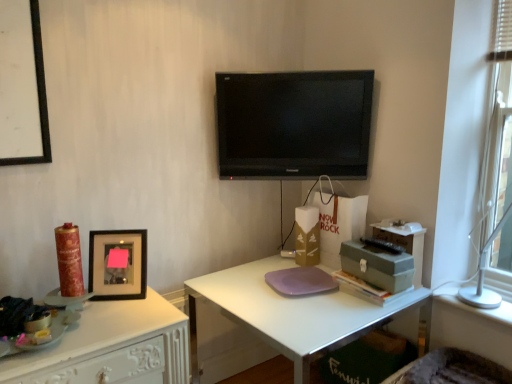
Where is `empty space that is ontop of matte green box at right, arranged as the first box when viewed from the left (from a real-world perspective)`? empty space that is ontop of matte green box at right, arranged as the first box when viewed from the left (from a real-world perspective) is located at coordinates (380, 252).